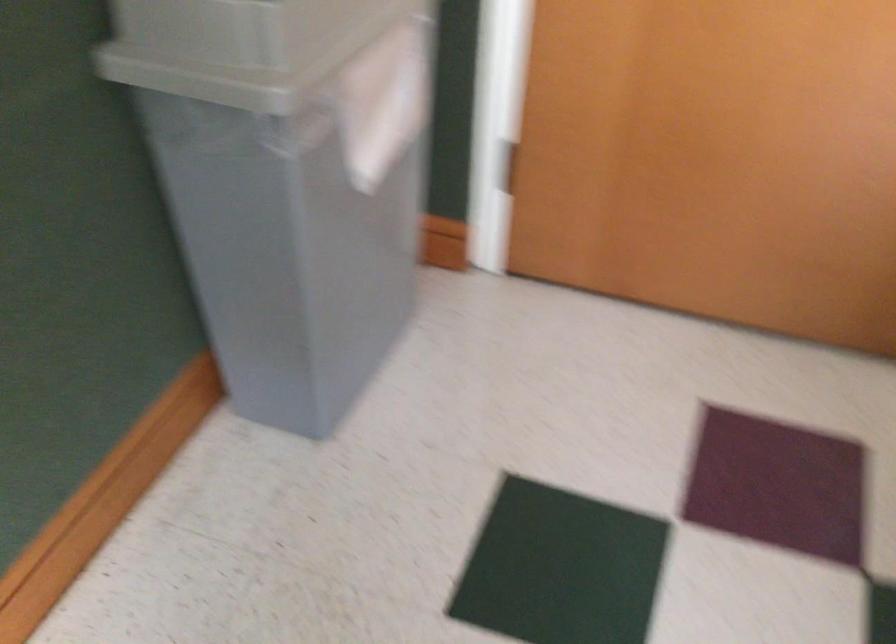
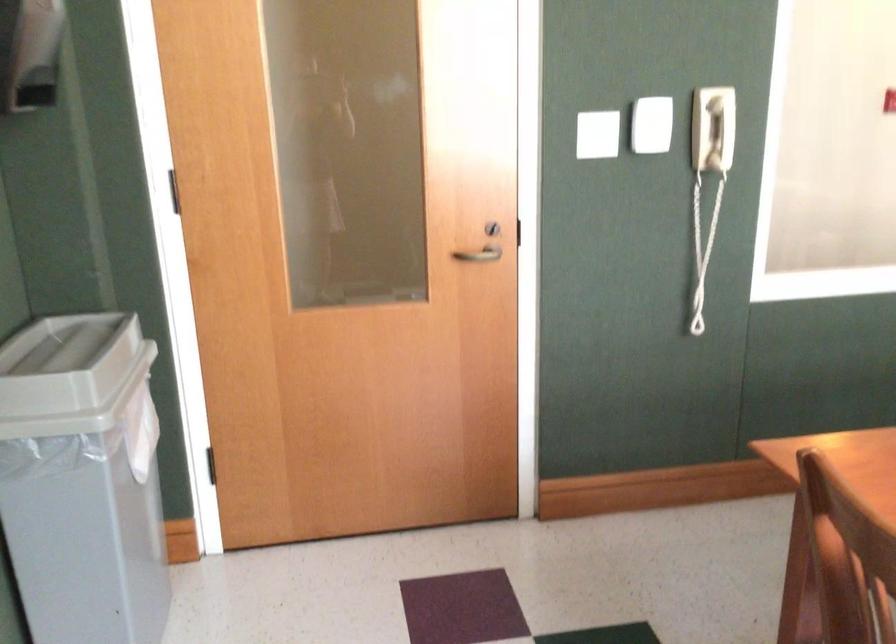
The first image is from the beginning of the video and the second image is from the end. How did the camera likely rotate when shooting the video?

The camera's rotation is toward right-up.